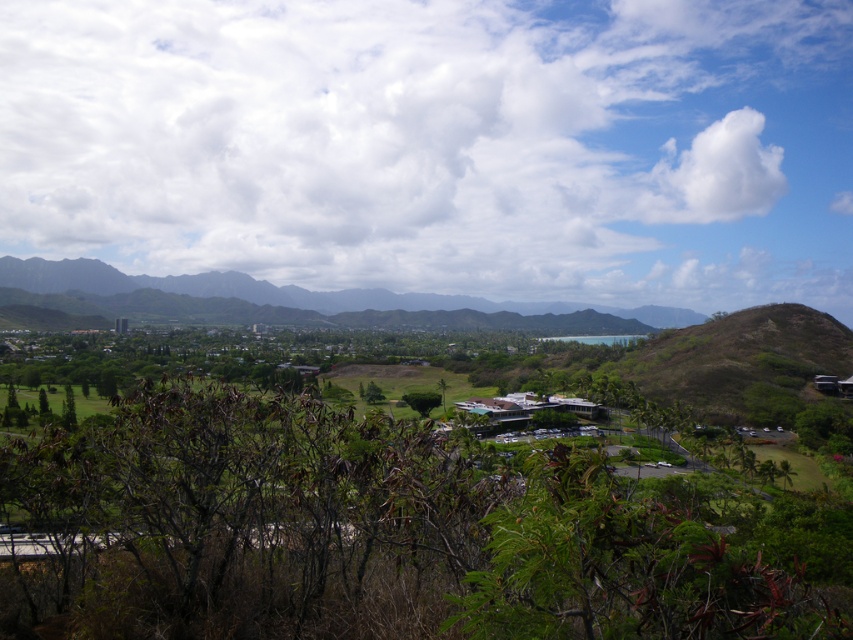
Is white fluffy cloud at upper center smaller than green leafy shrubs at center?

Incorrect, white fluffy cloud at upper center is not smaller in size than green leafy shrubs at center.

Is point (22, 184) positioned behind point (293, 404)?

Yes, point (22, 184) is farther from viewer.

At what (x,y) coordinates should I click in order to perform the action: click on white fluffy cloud at upper center. Please return your answer as a coordinate pair (x, y). The height and width of the screenshot is (640, 853). Looking at the image, I should click on (440, 145).

Does green leafy shrubs at center have a lesser width compared to white fluffy cloud at upper right?

Yes.

Does green leafy shrubs at center appear on the right side of white fluffy cloud at upper right?

In fact, green leafy shrubs at center is to the left of white fluffy cloud at upper right.

Identify the location of green leafy shrubs at center. (370, 532).

This screenshot has width=853, height=640. I want to click on green leafy shrubs at center, so click(x=370, y=532).

Which is in front, point (766, 163) or point (734, 138)?

Point (734, 138) is in front.

Is point (668, 244) closer to viewer compared to point (726, 129)?

That is True.

You are a GUI agent. You are given a task and a screenshot of the screen. Output one action in this format:
    pyautogui.click(x=<x>, y=<y>)
    Task: Click on the white fluffy cloud at upper center
    
    Given the screenshot: What is the action you would take?
    pyautogui.click(x=440, y=145)